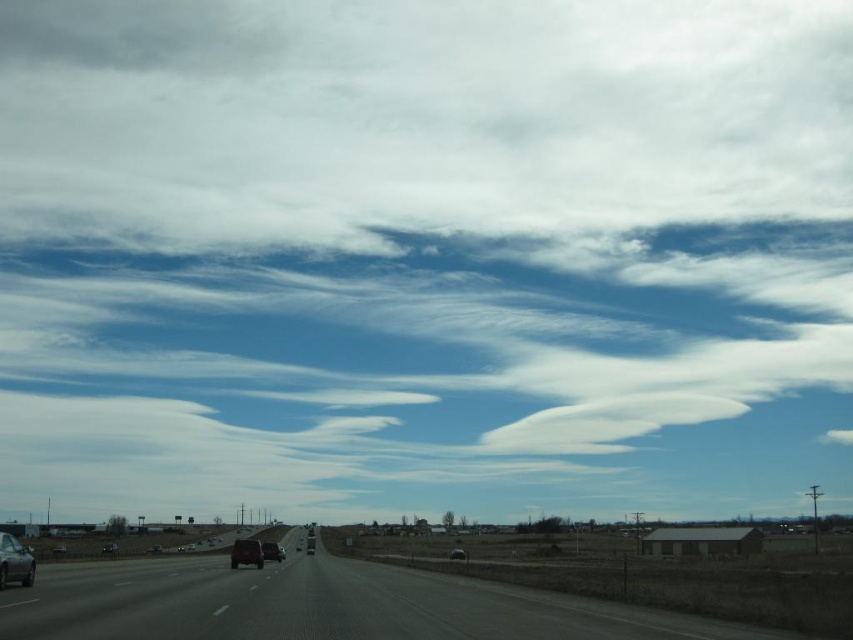
Which is in front, point (3, 563) or point (260, 554)?

Point (3, 563) is more forward.

Identify the location of matte black car at lower left. The height and width of the screenshot is (640, 853). (15, 561).

This screenshot has height=640, width=853. What do you see at coordinates (418, 120) in the screenshot?
I see `white fluffy cloud at upper center` at bounding box center [418, 120].

Is the position of white fluffy cloud at upper center more distant than that of matte black car at lower left?

Yes, white fluffy cloud at upper center is further from the viewer.

Between point (540, 67) and point (19, 552), which one is positioned in front?

Point (19, 552)

At what (x,y) coordinates should I click in order to perform the action: click on white fluffy cloud at upper center. Please return your answer as a coordinate pair (x, y). Looking at the image, I should click on (418, 120).

Is matte black car at lower left below metallic silver car at center?

Incorrect, matte black car at lower left is not positioned below metallic silver car at center.

Is matte black car at lower left further to camera compared to metallic silver car at center?

No, matte black car at lower left is in front of metallic silver car at center.

The width and height of the screenshot is (853, 640). What do you see at coordinates (15, 561) in the screenshot?
I see `matte black car at lower left` at bounding box center [15, 561].

Where is `matte black car at lower left`? matte black car at lower left is located at coordinates (15, 561).